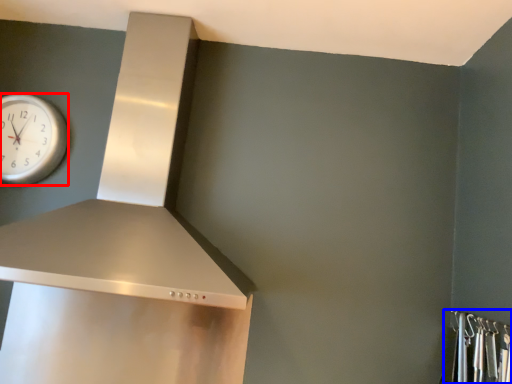
Question: Which object is closer to the camera taking this photo, wall clock (highlighted by a red box) or closet (highlighted by a blue box)?

Choices:
 (A) wall clock
 (B) closet

Answer: (B)